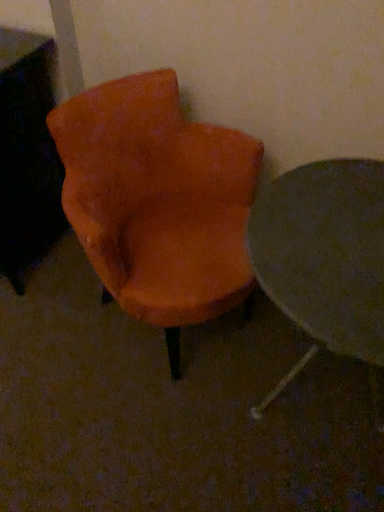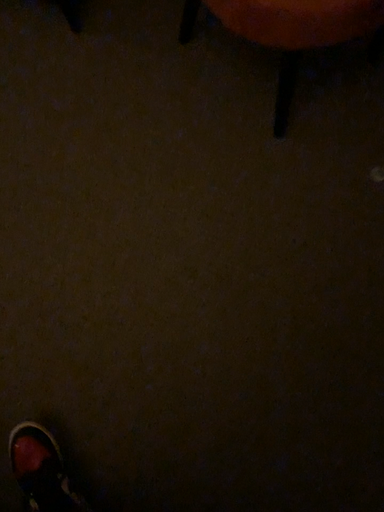
Question: Which way did the camera rotate in the video?

Choices:
 (A) rotated upward
 (B) rotated downward

Answer: (B)